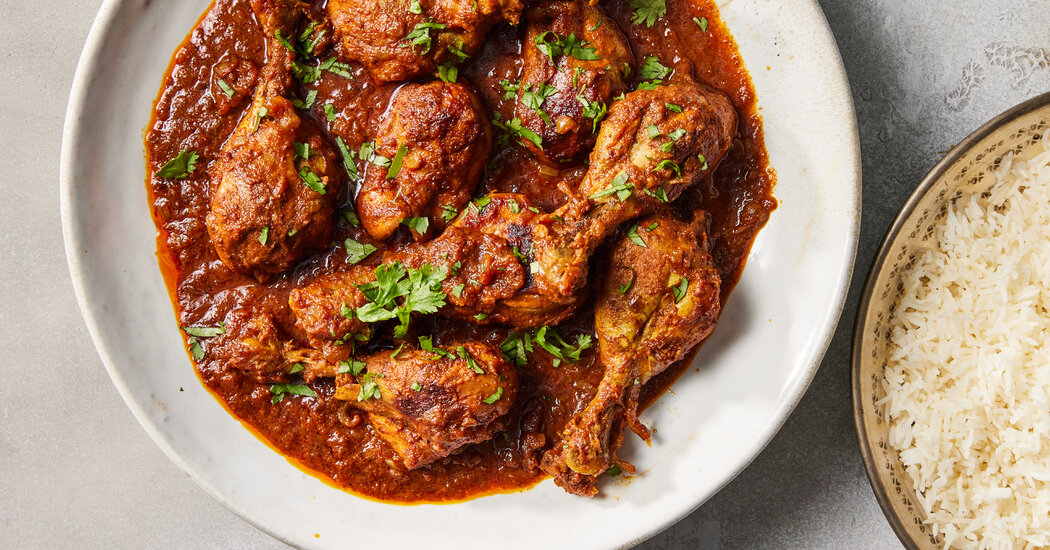
This screenshot has height=550, width=1050. I want to click on right side of white plate, so click(833, 204).